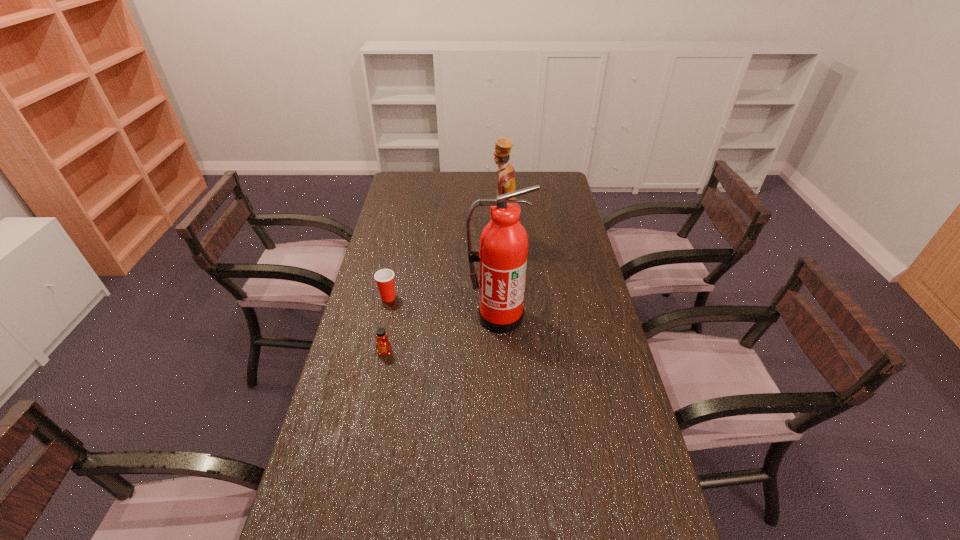
What are the coordinates of `fire extinguisher` in the screenshot? It's located at (503, 248).

The width and height of the screenshot is (960, 540). Identify the location of the farthest object. (506, 174).

Locate an element on the screen. Dixie cup is located at coordinates (384, 278).

The width and height of the screenshot is (960, 540). In order to click on the nearest object in this screenshot , I will do `click(383, 346)`.

Image resolution: width=960 pixels, height=540 pixels. I want to click on vacant space situated on the label side of the fire extinguisher, so click(x=503, y=430).

Where is `free spot located on the front-facing side of the nutcracker`? This screenshot has height=540, width=960. free spot located on the front-facing side of the nutcracker is located at coordinates (404, 247).

What are the coordinates of `blank space located on the front-facing side of the nutcracker` in the screenshot? It's located at (459, 247).

You are a GUI agent. You are given a task and a screenshot of the screen. Output one action in this format:
    pyautogui.click(x=<x>, y=<y>)
    Task: Click on the free location located 0.210m on the front-facing side of the nutcracker
    This screenshot has width=960, height=540.
    Given the screenshot: What is the action you would take?
    [437, 247]

You are a GUI agent. You are given a task and a screenshot of the screen. Output one action in this format:
    pyautogui.click(x=<x>, y=<y>)
    Task: Click on the vacant area located 0.140m on the right of the Dixie cup
    Image resolution: width=960 pixels, height=540 pixels.
    Given the screenshot: What is the action you would take?
    pyautogui.click(x=438, y=298)

The height and width of the screenshot is (540, 960). Find the location of `free space located on the front label of the honey`. free space located on the front label of the honey is located at coordinates (358, 483).